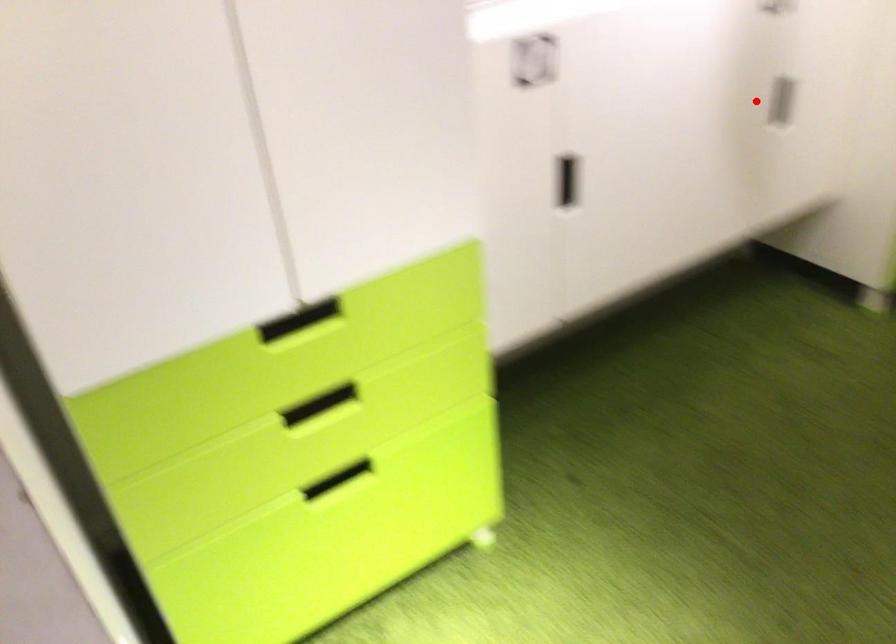
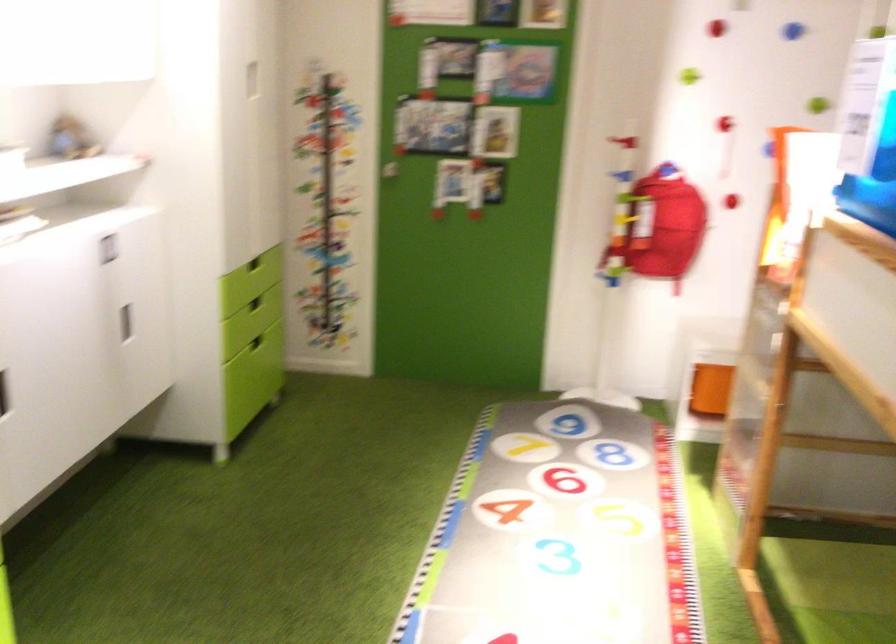
Question: I am providing you with two images of the same scene from different viewpoints. In image1, a red point is highlighted. Considering the same 3D point in image2, which of the following is correct?

Choices:
 (A) It is closer
 (B) It is farther

Answer: (B)